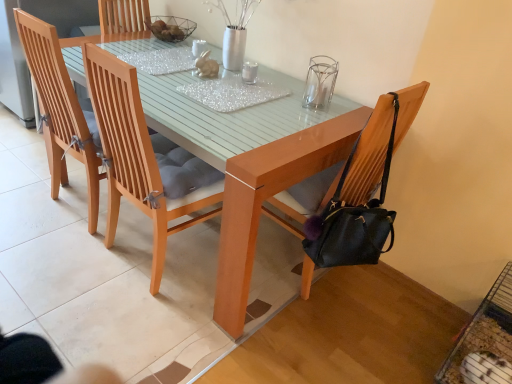
You are a GUI agent. You are given a task and a screenshot of the screen. Output one action in this format:
    pyautogui.click(x=<x>, y=<y>)
    Task: Click on the light brown wood chair at upper left, which is the 4th chair in right-to-left order
    
    Given the screenshot: What is the action you would take?
    pyautogui.click(x=72, y=89)

Locate an element on the screen. wooden chair at center, arranged as the third chair when viewed from the right is located at coordinates (136, 157).

Find the location of a particular element. light brown wooden chair at center, which is counted as the third chair, starting from the left is located at coordinates (231, 118).

Locate an element on the screen. The image size is (512, 384). light brown wood chair at upper left, which is the 4th chair in right-to-left order is located at coordinates (72, 89).

From the picture: Considering the relative sizes of transparent glass candle holder at upper center and wooden chair at center, positioned as the second chair in left-to-right order, in the image provided, is transparent glass candle holder at upper center taller than wooden chair at center, positioned as the second chair in left-to-right order,?

Incorrect, the height of transparent glass candle holder at upper center is not larger of that of wooden chair at center, positioned as the second chair in left-to-right order.

Would you say transparent glass candle holder at upper center is outside wooden chair at center, arranged as the third chair when viewed from the right?

Yes, transparent glass candle holder at upper center is located beyond the bounds of wooden chair at center, arranged as the third chair when viewed from the right.

Is transparent glass candle holder at upper center further to the viewer compared to wooden chair at center, arranged as the third chair when viewed from the right?

Yes, transparent glass candle holder at upper center is further from the camera.

Are transparent glass candle holder at upper center and wooden chair at center, positioned as the second chair in left-to-right order, making contact?

There is a gap between transparent glass candle holder at upper center and wooden chair at center, positioned as the second chair in left-to-right order.

Is wooden chair at center, arranged as the third chair when viewed from the right, bigger than light brown wood chair at upper left, which is the 4th chair in right-to-left order?

Incorrect, wooden chair at center, arranged as the third chair when viewed from the right, is not larger than light brown wood chair at upper left, which is the 4th chair in right-to-left order.

From the image's perspective, is wooden chair at center, arranged as the third chair when viewed from the right, above or below light brown wood chair at upper left, which ranks as the first chair in left-to-right order?

wooden chair at center, arranged as the third chair when viewed from the right, is situated lower than light brown wood chair at upper left, which ranks as the first chair in left-to-right order, in the image.

Between wooden chair at center, positioned as the second chair in left-to-right order, and light brown wood chair at upper left, which ranks as the first chair in left-to-right order, which one is positioned behind?

light brown wood chair at upper left, which ranks as the first chair in left-to-right order.

Is light brown wood chair at upper left, which is the 4th chair in right-to-left order, at the back of wooden chair at center, arranged as the third chair when viewed from the right?

wooden chair at center, arranged as the third chair when viewed from the right, is not turned away from light brown wood chair at upper left, which is the 4th chair in right-to-left order.

From the image's perspective, would you say light brown wooden chair at center, which is counted as the third chair, starting from the left, is positioned over wooden chair at center, arranged as the third chair when viewed from the right?

Yes.

Considering the sizes of objects light brown wooden chair at center, which is counted as the third chair, starting from the left, and wooden chair at center, arranged as the third chair when viewed from the right, in the image provided, who is bigger, light brown wooden chair at center, which is counted as the third chair, starting from the left, or wooden chair at center, arranged as the third chair when viewed from the right,?

With larger size is light brown wooden chair at center, which is counted as the third chair, starting from the left.

Does light brown wooden chair at center, arranged as the 2th chair when viewed from the right, have a lesser width compared to wooden chair at center, arranged as the third chair when viewed from the right?

In fact, light brown wooden chair at center, arranged as the 2th chair when viewed from the right, might be wider than wooden chair at center, arranged as the third chair when viewed from the right.

Is black leather chair at right, placed as the first chair when sorted from right to left, taller than wooden chair at center, positioned as the second chair in left-to-right order?

Yes, black leather chair at right, placed as the first chair when sorted from right to left, is taller than wooden chair at center, positioned as the second chair in left-to-right order.

Is black leather chair at right, which appears as the fourth chair when viewed from the left, located outside wooden chair at center, arranged as the third chair when viewed from the right?

Yes, black leather chair at right, which appears as the fourth chair when viewed from the left, is outside of wooden chair at center, arranged as the third chair when viewed from the right.

How many degrees apart are the facing directions of black leather chair at right, which appears as the fourth chair when viewed from the left, and wooden chair at center, positioned as the second chair in left-to-right order?

There is a 87.5-degree angle between the facing directions of black leather chair at right, which appears as the fourth chair when viewed from the left, and wooden chair at center, positioned as the second chair in left-to-right order.

Is black leather chair at right, which appears as the fourth chair when viewed from the left, touching wooden chair at center, positioned as the second chair in left-to-right order?

No, black leather chair at right, which appears as the fourth chair when viewed from the left, is not with wooden chair at center, positioned as the second chair in left-to-right order.

Which point is more forward, (321, 74) or (132, 28)?

The point (321, 74) is in front.

From a real-world perspective, is transparent glass candle holder at upper center over light brown wood chair at upper left, which is the 4th chair in right-to-left order?

Correct, in the physical world, transparent glass candle holder at upper center is higher than light brown wood chair at upper left, which is the 4th chair in right-to-left order.

Considering their positions, is transparent glass candle holder at upper center located in front of or behind light brown wood chair at upper left, which is the 4th chair in right-to-left order?

transparent glass candle holder at upper center is positioned farther from the viewer than light brown wood chair at upper left, which is the 4th chair in right-to-left order.

Could you tell me if transparent glass candle holder at upper center is facing light brown wood chair at upper left, which is the 4th chair in right-to-left order?

No, transparent glass candle holder at upper center does not turn towards light brown wood chair at upper left, which is the 4th chair in right-to-left order.

Considering the sizes of objects black leather chair at right, which appears as the fourth chair when viewed from the left, and light brown wood chair at upper left, which is the 4th chair in right-to-left order, in the image provided, who is smaller, black leather chair at right, which appears as the fourth chair when viewed from the left, or light brown wood chair at upper left, which is the 4th chair in right-to-left order,?

With smaller size is black leather chair at right, which appears as the fourth chair when viewed from the left.

From the image's perspective, is black leather chair at right, which appears as the fourth chair when viewed from the left, above or below light brown wood chair at upper left, which is the 4th chair in right-to-left order?

black leather chair at right, which appears as the fourth chair when viewed from the left, is below light brown wood chair at upper left, which is the 4th chair in right-to-left order.

Which is correct: black leather chair at right, which appears as the fourth chair when viewed from the left, is inside light brown wood chair at upper left, which ranks as the first chair in left-to-right order, or outside of it?

black leather chair at right, which appears as the fourth chair when viewed from the left, is not enclosed by light brown wood chair at upper left, which ranks as the first chair in left-to-right order.

How far apart are black leather chair at right, which appears as the fourth chair when viewed from the left, and light brown wood chair at upper left, which is the 4th chair in right-to-left order?

black leather chair at right, which appears as the fourth chair when viewed from the left, is 95.30 centimeters from light brown wood chair at upper left, which is the 4th chair in right-to-left order.

Is light brown wood chair at upper left, which is the 4th chair in right-to-left order, facing away from transparent glass candle holder at upper center?

No, light brown wood chair at upper left, which is the 4th chair in right-to-left order, is not facing the opposite direction of transparent glass candle holder at upper center.

In the scene shown: Would you say light brown wood chair at upper left, which ranks as the first chair in left-to-right order, is outside transparent glass candle holder at upper center?

light brown wood chair at upper left, which ranks as the first chair in left-to-right order, is positioned outside transparent glass candle holder at upper center.

Is point (75, 125) farther from viewer compared to point (330, 75)?

Yes, point (75, 125) is behind point (330, 75).

Between light brown wood chair at upper left, which ranks as the first chair in left-to-right order, and transparent glass candle holder at upper center, which one has larger size?

With larger size is light brown wood chair at upper left, which ranks as the first chair in left-to-right order.

Find the location of a particular element. Image resolution: width=512 pixels, height=384 pixels. the 4th chair in front of the transparent glass candle holder at upper center is located at coordinates (136, 157).

Identify the location of the 1st chair counting from the right of the light brown wood chair at upper left, which ranks as the first chair in left-to-right order. The height and width of the screenshot is (384, 512). (136, 157).

Estimate the real-world distances between objects in this image. Which object is further from transparent glass candle holder at upper center, wooden chair at center, positioned as the second chair in left-to-right order, or light brown wooden chair at center, which is counted as the third chair, starting from the left?

The object further to transparent glass candle holder at upper center is wooden chair at center, positioned as the second chair in left-to-right order.

From the image, which object appears to be nearer to light brown wood chair at upper left, which is the 4th chair in right-to-left order, transparent glass candle holder at upper center or wooden chair at center, positioned as the second chair in left-to-right order?

wooden chair at center, positioned as the second chair in left-to-right order, lies closer to light brown wood chair at upper left, which is the 4th chair in right-to-left order, than the other object.

From the image, which object appears to be nearer to light brown wooden chair at center, which is counted as the third chair, starting from the left, light brown wood chair at upper left, which ranks as the first chair in left-to-right order, or wooden chair at center, arranged as the third chair when viewed from the right?

wooden chair at center, arranged as the third chair when viewed from the right, is closer to light brown wooden chair at center, which is counted as the third chair, starting from the left.

Which object lies nearer to the anchor point wooden chair at center, arranged as the third chair when viewed from the right, black leather chair at right, which appears as the fourth chair when viewed from the left, or light brown wood chair at upper left, which ranks as the first chair in left-to-right order?

light brown wood chair at upper left, which ranks as the first chair in left-to-right order, is closer to wooden chair at center, arranged as the third chair when viewed from the right.

Considering their positions, is light brown wooden chair at center, which is counted as the third chair, starting from the left, positioned closer to transparent glass candle holder at upper center than light brown wood chair at upper left, which is the 4th chair in right-to-left order?

light brown wooden chair at center, which is counted as the third chair, starting from the left.

Looking at the image, which one is located further to wooden chair at center, positioned as the second chair in left-to-right order, black leather chair at right, which appears as the fourth chair when viewed from the left, or transparent glass candle holder at upper center?

transparent glass candle holder at upper center.

Looking at the image, which one is located closer to transparent glass candle holder at upper center, black leather chair at right, placed as the first chair when sorted from right to left, or light brown wood chair at upper left, which ranks as the first chair in left-to-right order?

black leather chair at right, placed as the first chair when sorted from right to left, is positioned closer to the anchor transparent glass candle holder at upper center.

Estimate the real-world distances between objects in this image. Which object is further from wooden chair at center, positioned as the second chair in left-to-right order, light brown wooden chair at center, arranged as the 2th chair when viewed from the right, or transparent glass candle holder at upper center?

The object further to wooden chair at center, positioned as the second chair in left-to-right order, is transparent glass candle holder at upper center.

You are a GUI agent. You are given a task and a screenshot of the screen. Output one action in this format:
    pyautogui.click(x=<x>, y=<y>)
    Task: Click on the chair situated between light brown wood chair at upper left, which is the 4th chair in right-to-left order, and light brown wooden chair at center, arranged as the 2th chair when viewed from the right, from left to right
    The height and width of the screenshot is (384, 512).
    Given the screenshot: What is the action you would take?
    pyautogui.click(x=136, y=157)

Locate an element on the screen. This screenshot has width=512, height=384. clear between light brown wood chair at upper left, which ranks as the first chair in left-to-right order, and black leather chair at right, placed as the first chair when sorted from right to left, in the horizontal direction is located at coordinates (320, 82).

Locate an element on the screen. The width and height of the screenshot is (512, 384). chair situated between wooden chair at center, positioned as the second chair in left-to-right order, and transparent glass candle holder at upper center from left to right is located at coordinates (231, 118).

Identify the location of clear located between light brown wooden chair at center, which is counted as the third chair, starting from the left, and black leather chair at right, which appears as the fourth chair when viewed from the left, in the left-right direction. The image size is (512, 384). (320, 82).